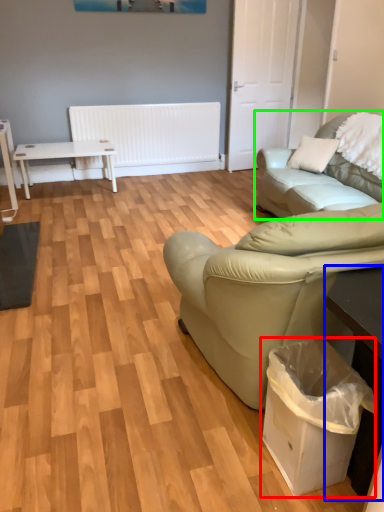
Question: Which object is the closest to the garbage (highlighted by a red box)? Choose among these: table (highlighted by a blue box) or studio couch (highlighted by a green box).

Choices:
 (A) table
 (B) studio couch

Answer: (A)